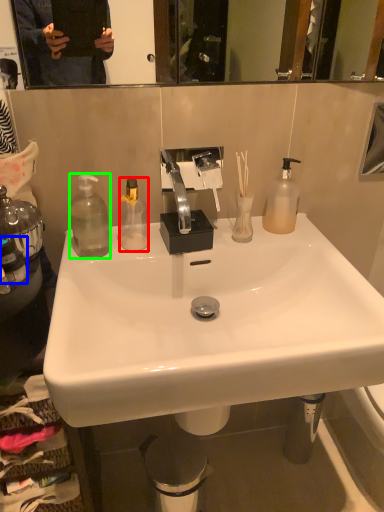
Question: Considering the real-world distances, which object is closest to bottle (highlighted by a red box)? bottle (highlighted by a blue box) or bottle (highlighted by a green box).

Choices:
 (A) bottle
 (B) bottle

Answer: (B)